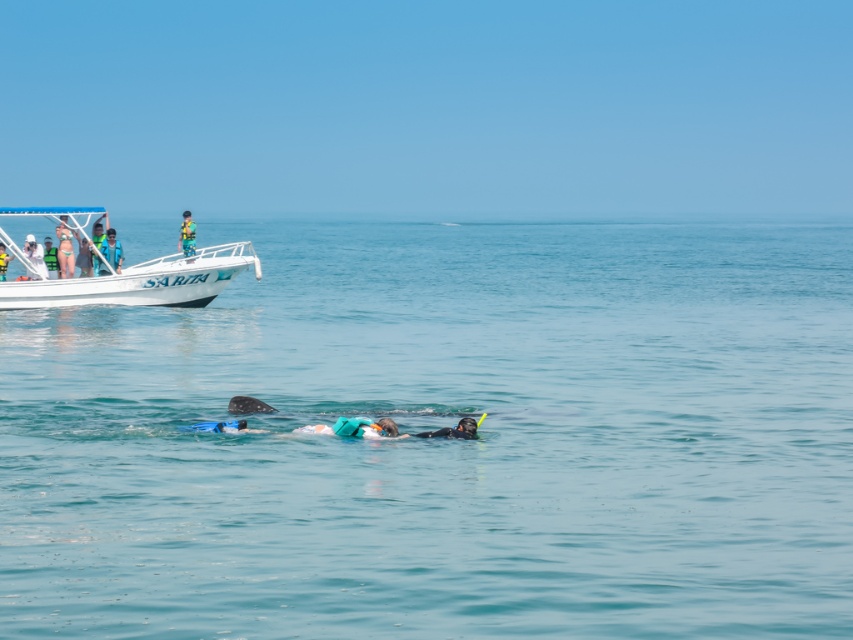
You are on a boat and need to determine which point is closer to you. The points are point (469, 419) and point (86, 256). Which point is closer to you?

Point (469, 419) is closer to the viewer than point (86, 256).

You are designing a storage compartment for a boat. The compartment must fit both the black rubber snorkel at center and the matte green bikini at upper left. Which item requires more width in the compartment?

The black rubber snorkel at center is wider than the matte green bikini at upper left, so it requires more width in the compartment.